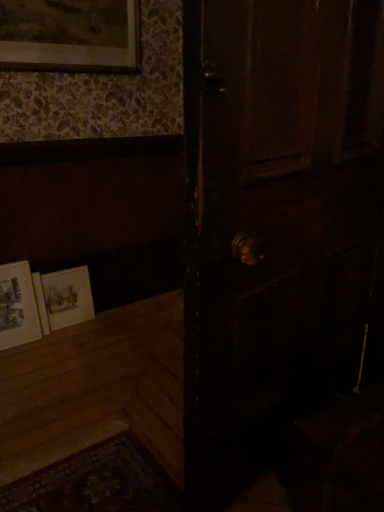
Locate an element on the screen. vacant space situated on the left part of dark wood door at center is located at coordinates (110, 422).